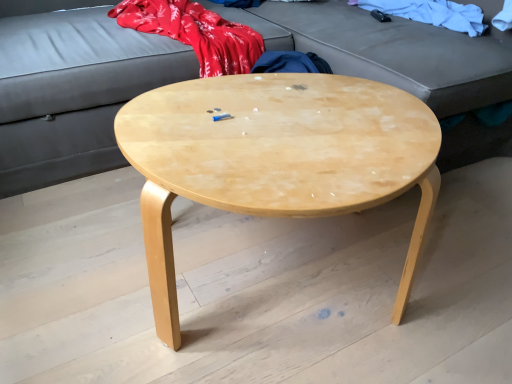
Image resolution: width=512 pixels, height=384 pixels. What are the coordinates of `white cotton cloth at upper right` in the screenshot? It's located at (431, 13).

The image size is (512, 384). What are the coordinates of `clothing that appears behind the matte gray studio couch at upper center` in the screenshot? It's located at (431, 13).

In the scene shown: How different are the orientations of matte gray studio couch at upper center and white cotton cloth at upper right in degrees?

7.93 degrees separate the facing orientations of matte gray studio couch at upper center and white cotton cloth at upper right.

From the image's perspective, is matte gray studio couch at upper center located beneath white cotton cloth at upper right?

Yes, from the image's perspective, matte gray studio couch at upper center is below white cotton cloth at upper right.

Considering the sizes of matte gray studio couch at upper center and white cotton cloth at upper right in the image, is matte gray studio couch at upper center taller or shorter than white cotton cloth at upper right?

Clearly, matte gray studio couch at upper center is taller compared to white cotton cloth at upper right.

Would you say matte gray studio couch at upper center is inside or outside natural wood coffee table at center?

matte gray studio couch at upper center exists outside the volume of natural wood coffee table at center.

Considering the relative sizes of matte gray studio couch at upper center and natural wood coffee table at center in the image provided, is matte gray studio couch at upper center wider than natural wood coffee table at center?

Yes, matte gray studio couch at upper center is wider than natural wood coffee table at center.

From a real-world perspective, is matte gray studio couch at upper center beneath natural wood coffee table at center?

No, from a real-world perspective, matte gray studio couch at upper center is not beneath natural wood coffee table at center.

Is white cotton cloth at upper right next to natural wood coffee table at center?

white cotton cloth at upper right is not next to natural wood coffee table at center, and they're not touching.

From a real-world perspective, is white cotton cloth at upper right positioned over natural wood coffee table at center based on gravity?

Yes, from a real-world perspective, white cotton cloth at upper right is above natural wood coffee table at center.

Is white cotton cloth at upper right facing away from natural wood coffee table at center?

That's not correct — white cotton cloth at upper right is not looking away from natural wood coffee table at center.

Between white cotton cloth at upper right and natural wood coffee table at center, which one has larger width?

Wider between the two is natural wood coffee table at center.

From the image's perspective, is white cotton cloth at upper right below matte gray studio couch at upper center?

Actually, white cotton cloth at upper right appears above matte gray studio couch at upper center in the image.

Consider the image. From a real-world perspective, which is physically below, white cotton cloth at upper right or matte gray studio couch at upper center?

matte gray studio couch at upper center, from a real-world perspective.

The height and width of the screenshot is (384, 512). Find the location of `clothing behind the matte gray studio couch at upper center`. clothing behind the matte gray studio couch at upper center is located at coordinates (431, 13).

Would you say white cotton cloth at upper right is to the left or to the right of matte gray studio couch at upper center in the picture?

In the image, white cotton cloth at upper right appears on the right side of matte gray studio couch at upper center.

Considering the sizes of natural wood coffee table at center and white cotton cloth at upper right in the image, is natural wood coffee table at center wider or thinner than white cotton cloth at upper right?

In the image, natural wood coffee table at center appears to be wider than white cotton cloth at upper right.

I want to click on coffee table below the white cotton cloth at upper right (from a real-world perspective), so click(x=275, y=158).

In terms of height, does natural wood coffee table at center look taller or shorter compared to white cotton cloth at upper right?

natural wood coffee table at center is taller than white cotton cloth at upper right.

From the image's perspective, does natural wood coffee table at center appear higher than white cotton cloth at upper right?

No, from the image's perspective, natural wood coffee table at center is not over white cotton cloth at upper right.

Which of these two, natural wood coffee table at center or matte gray studio couch at upper center, is bigger?

With larger size is matte gray studio couch at upper center.

Is natural wood coffee table at center far away from matte gray studio couch at upper center?

No, natural wood coffee table at center is in close proximity to matte gray studio couch at upper center.

Which object is positioned more to the right, natural wood coffee table at center or matte gray studio couch at upper center?

Positioned to the right is matte gray studio couch at upper center.

I want to click on studio couch lying on the left of white cotton cloth at upper right, so click(x=70, y=95).

There is a natural wood coffee table at center. At what (x,y) coordinates should I click in order to perform the action: click on studio couch above it (from a real-world perspective). Please return your answer as a coordinate pair (x, y). The width and height of the screenshot is (512, 384). Looking at the image, I should click on (70, 95).

Which object lies nearer to the anchor point white cotton cloth at upper right, matte gray studio couch at upper center or natural wood coffee table at center?

matte gray studio couch at upper center lies closer to white cotton cloth at upper right than the other object.

Which object lies further to the anchor point white cotton cloth at upper right, natural wood coffee table at center or matte gray studio couch at upper center?

The object further to white cotton cloth at upper right is natural wood coffee table at center.

Looking at the image, which one is located further to natural wood coffee table at center, matte gray studio couch at upper center or white cotton cloth at upper right?

white cotton cloth at upper right is further to natural wood coffee table at center.

Which object lies nearer to the anchor point matte gray studio couch at upper center, white cotton cloth at upper right or natural wood coffee table at center?

white cotton cloth at upper right lies closer to matte gray studio couch at upper center than the other object.

Consider the image. Based on their spatial positions, is natural wood coffee table at center or white cotton cloth at upper right closer to matte gray studio couch at upper center?

The object closer to matte gray studio couch at upper center is white cotton cloth at upper right.

Considering their positions, is white cotton cloth at upper right positioned closer to natural wood coffee table at center than matte gray studio couch at upper center?

matte gray studio couch at upper center.

Locate an element on the screen. studio couch between white cotton cloth at upper right and natural wood coffee table at center in the vertical direction is located at coordinates (70, 95).